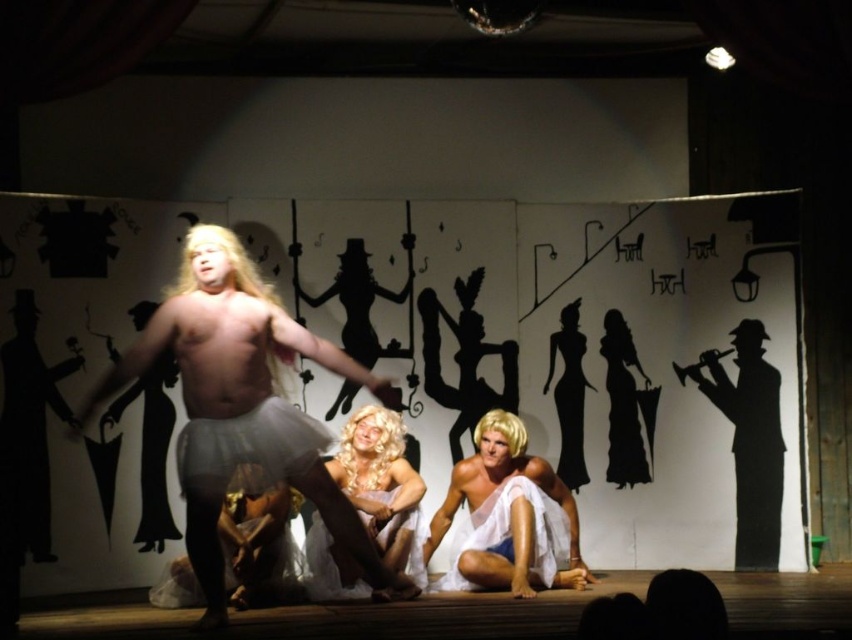
You are a stagehand adjusting the lighting for the performance. You need to ensure that the white sheer skirt at center and the black paper trumpet at right are both illuminated. Which object should you focus the spotlight on first to ensure it is properly lit since it is closer to the audience?

The white sheer skirt at center should be focused on first because it is closer to the viewer than the black paper trumpet at right, so it requires immediate attention to ensure proper lighting.

In the scene shown: Based on the coordinates provided in the scene description, where exactly is the white fabric draped at center located?

The white fabric draped at center is located at point coordinates of 0.809 in the x axis and 0.597 in the y axis.

What is located at the coordinates point (243,406)?

The white sheer skirt at center is located at point (243,406).